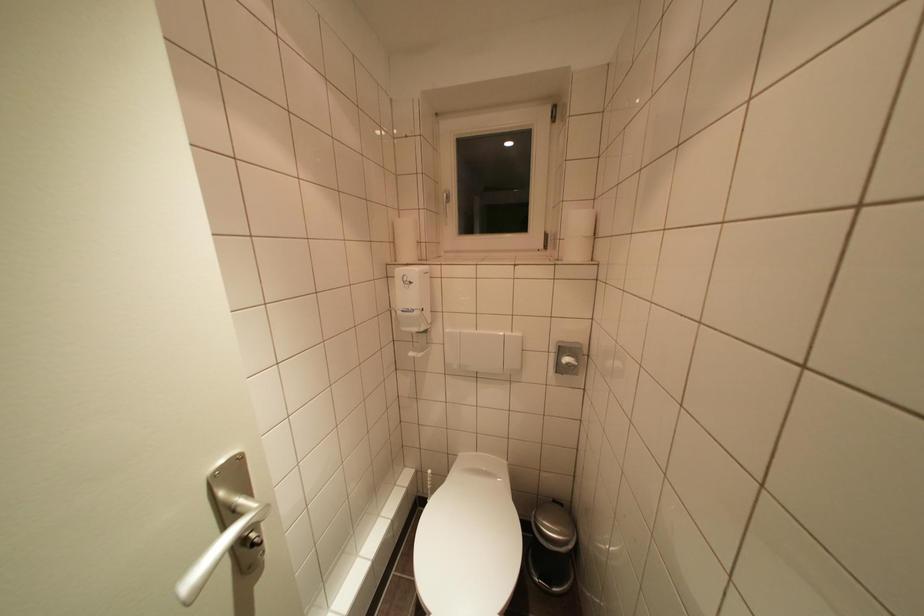
Locate an element on the screen. The height and width of the screenshot is (616, 924). silver door handle is located at coordinates (220, 545).